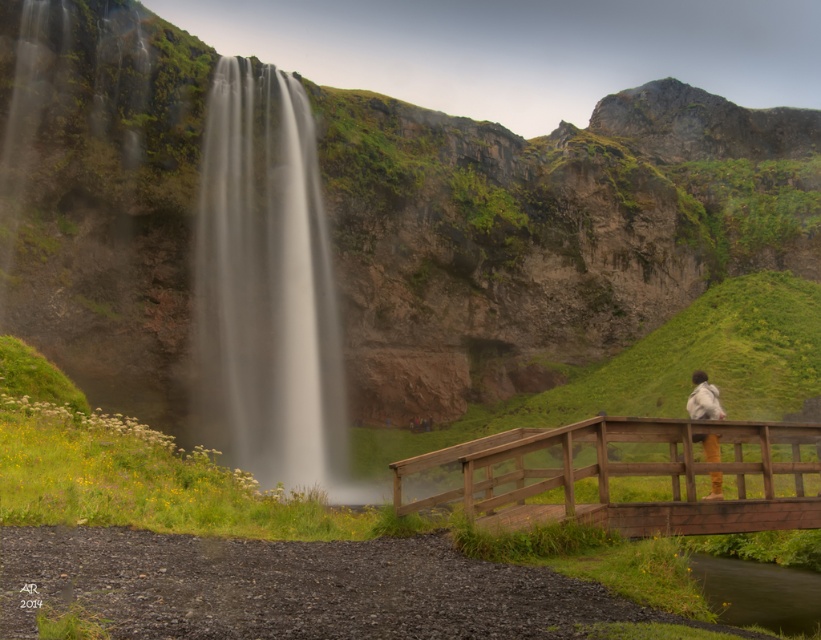
Question: Can you confirm if wooden bridge at center is thinner than light gray fabric jacket at upper right?

Choices:
 (A) yes
 (B) no

Answer: (B)

Question: Is white smooth waterfall at left above wooden bridge at center?

Choices:
 (A) no
 (B) yes

Answer: (B)

Question: Which is nearer to the white smooth waterfall at left?

Choices:
 (A) light gray fabric jacket at upper right
 (B) wooden bridge at center

Answer: (A)

Question: Considering the relative positions of wooden bridge at center and light gray fabric jacket at upper right in the image provided, where is wooden bridge at center located with respect to light gray fabric jacket at upper right?

Choices:
 (A) left
 (B) right

Answer: (A)

Question: Which is farther from the white smooth waterfall at left?

Choices:
 (A) wooden bridge at center
 (B) light gray fabric jacket at upper right

Answer: (A)

Question: Which point is farther to the camera?

Choices:
 (A) wooden bridge at center
 (B) white smooth waterfall at left

Answer: (B)